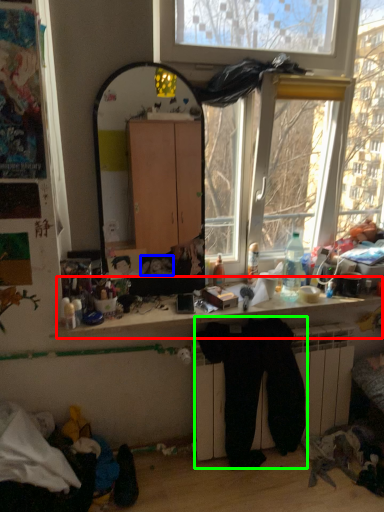
Question: Which object is the farthest from computer desk (highlighted by a red box)? Choose among these: person (highlighted by a blue box) or clothing (highlighted by a green box).

Choices:
 (A) person
 (B) clothing

Answer: (A)